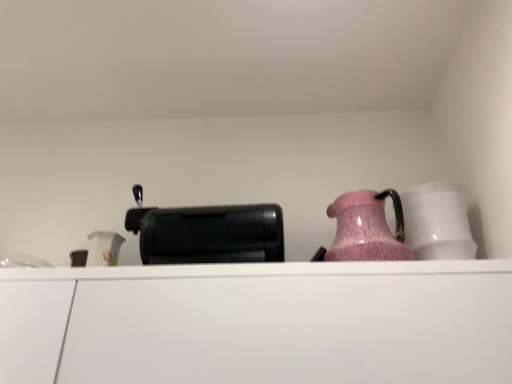
What do you see at coordinates (437, 222) in the screenshot? I see `white glossy mug at right` at bounding box center [437, 222].

Measure the distance between white glossy mug at right and camera.

They are 1.12 meters apart.

This screenshot has width=512, height=384. What do you see at coordinates (367, 228) in the screenshot?
I see `pink glossy jug at upper right` at bounding box center [367, 228].

You are a GUI agent. You are given a task and a screenshot of the screen. Output one action in this format:
    pyautogui.click(x=<x>, y=<y>)
    Task: Click on the white glossy mug at right
    The image size is (512, 384).
    Given the screenshot: What is the action you would take?
    pyautogui.click(x=437, y=222)

Would you say white glossy mug at right is inside or outside white matte cabinet at center?

white glossy mug at right is outside white matte cabinet at center.

From the image's perspective, is white glossy mug at right located beneath white matte cabinet at center?

No, from the image's perspective, white glossy mug at right is not below white matte cabinet at center.

Is white glossy mug at right looking in the opposite direction of white matte cabinet at center?

No, white matte cabinet at center is not at the back of white glossy mug at right.

Is point (443, 223) closer or farther from the camera than point (122, 308)?

Point (443, 223) is positioned farther from the camera compared to point (122, 308).

Which is more to the left, pink glossy jug at upper right or white glossy mug at right?

pink glossy jug at upper right is more to the left.

Could white glossy mug at right be considered to be inside pink glossy jug at upper right?

No, pink glossy jug at upper right does not contain white glossy mug at right.

Is the depth of pink glossy jug at upper right greater than that of white glossy mug at right?

No, pink glossy jug at upper right is closer to the camera.

Would you consider pink glossy jug at upper right to be distant from white glossy mug at right?

No, pink glossy jug at upper right is not far away from white glossy mug at right.

Is white glossy mug at right facing away from pink glossy jug at upper right?

white glossy mug at right is not turned away from pink glossy jug at upper right.

Is point (434, 183) farther from camera compared to point (357, 212)?

Yes, it is.

Is pink glossy jug at upper right oriented towards black plastic toaster at center?

No, pink glossy jug at upper right is not facing towards black plastic toaster at center.

Between pink glossy jug at upper right and black plastic toaster at center, which one has smaller size?

Smaller between the two is pink glossy jug at upper right.

Is pink glossy jug at upper right surrounding black plastic toaster at center?

No, black plastic toaster at center is not surrounded by pink glossy jug at upper right.

Who is shorter, white matte cabinet at center or black plastic toaster at center?

With less height is black plastic toaster at center.

Is white matte cabinet at center inside or outside of black plastic toaster at center?

white matte cabinet at center is not enclosed by black plastic toaster at center.

Based on the photo, from a real-world perspective, between white matte cabinet at center and black plastic toaster at center, who is vertically lower?

From a 3D spatial view, white matte cabinet at center is below.

Is black plastic toaster at center in contact with white glossy mug at right?

No, black plastic toaster at center is not beside white glossy mug at right.

Can you confirm if black plastic toaster at center is wider than white glossy mug at right?

In fact, black plastic toaster at center might be narrower than white glossy mug at right.

Is black plastic toaster at center shorter than white glossy mug at right?

Yes.

Is pink glossy jug at upper right facing away from white matte cabinet at center?

That's not correct — pink glossy jug at upper right is not looking away from white matte cabinet at center.

Which is closer to the camera, [369,241] or [222,361]?

Point [369,241] is farther from the camera than point [222,361].

Can you confirm if pink glossy jug at upper right is thinner than white matte cabinet at center?

Correct, the width of pink glossy jug at upper right is less than that of white matte cabinet at center.

Find the location of a particular element. tableware on the right of the white matte cabinet at center is located at coordinates (437, 222).

Where is `jug below the white glossy mug at right (from the image's perspective)`? The height and width of the screenshot is (384, 512). jug below the white glossy mug at right (from the image's perspective) is located at coordinates (367, 228).

Considering their positions, is pink glossy jug at upper right positioned further to black plastic toaster at center than white matte cabinet at center?

The object further to black plastic toaster at center is pink glossy jug at upper right.

Which object lies further to the anchor point white glossy mug at right, black plastic toaster at center or pink glossy jug at upper right?

black plastic toaster at center is further to white glossy mug at right.

From the image, which object appears to be nearer to black plastic toaster at center, white matte cabinet at center or pink glossy jug at upper right?

white matte cabinet at center is positioned closer to the anchor black plastic toaster at center.

Considering their positions, is black plastic toaster at center positioned further to pink glossy jug at upper right than white glossy mug at right?

black plastic toaster at center lies further to pink glossy jug at upper right than the other object.

Estimate the real-world distances between objects in this image. Which object is closer to pink glossy jug at upper right, white glossy mug at right or white matte cabinet at center?

white glossy mug at right is closer to pink glossy jug at upper right.

Looking at the image, which one is located further to pink glossy jug at upper right, white glossy mug at right or black plastic toaster at center?

black plastic toaster at center is positioned further to the anchor pink glossy jug at upper right.

Based on their spatial positions, is white matte cabinet at center or black plastic toaster at center closer to pink glossy jug at upper right?

white matte cabinet at center lies closer to pink glossy jug at upper right than the other object.

Looking at this image, considering their positions, is white glossy mug at right positioned further to black plastic toaster at center than pink glossy jug at upper right?

Based on the image, white glossy mug at right appears to be further to black plastic toaster at center.

The height and width of the screenshot is (384, 512). I want to click on cabinetry located between black plastic toaster at center and pink glossy jug at upper right in the left-right direction, so click(271, 323).

Where is `jug located between white matte cabinet at center and white glossy mug at right in the left-right direction`? This screenshot has height=384, width=512. jug located between white matte cabinet at center and white glossy mug at right in the left-right direction is located at coordinates [x=367, y=228].

Identify the location of jug situated between black plastic toaster at center and white glossy mug at right from left to right. This screenshot has width=512, height=384. (367, 228).

This screenshot has width=512, height=384. In order to click on cabinetry between black plastic toaster at center and white glossy mug at right in this screenshot , I will do `click(271, 323)`.